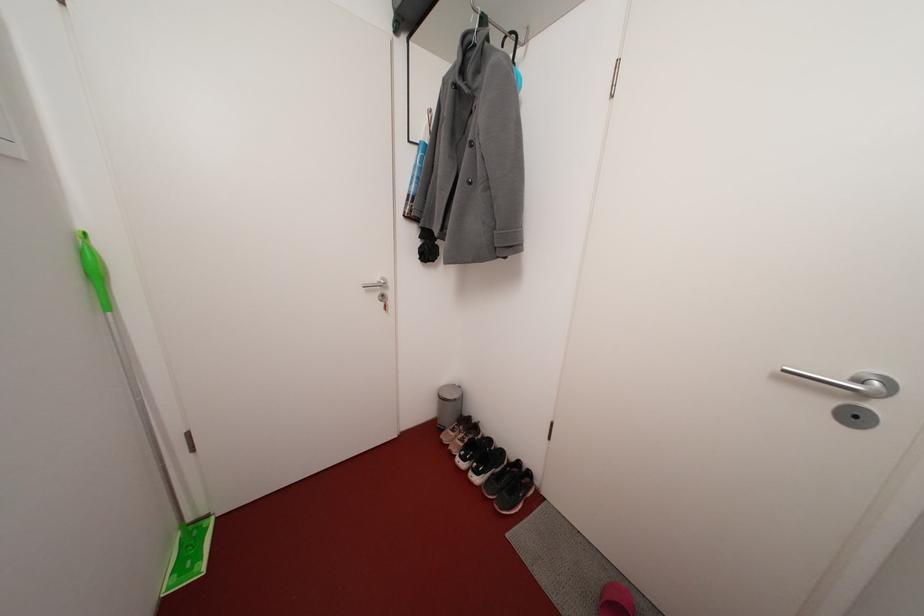
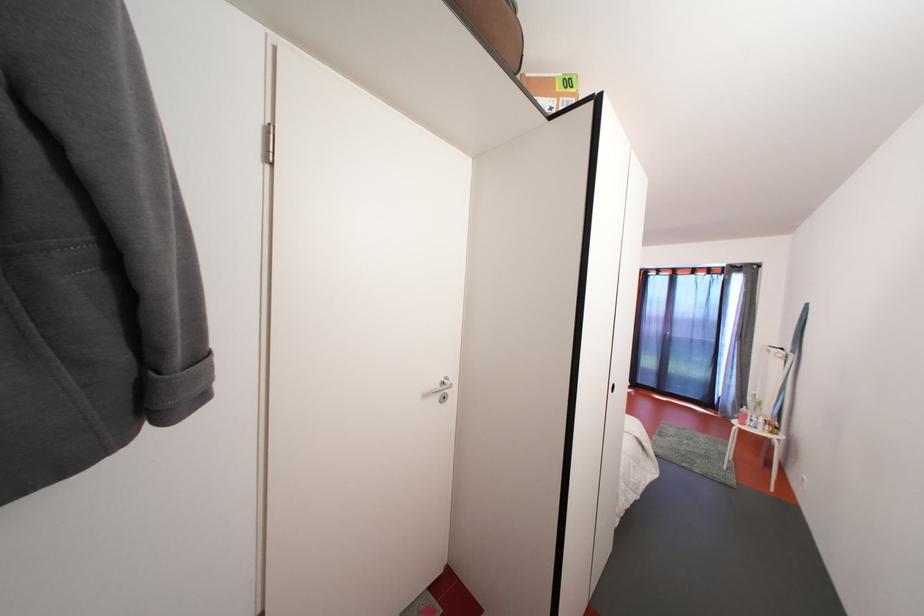
Question: The images are taken continuously from a first-person perspective. In which direction is your viewpoint rotating?

Choices:
 (A) Left
 (B) Right
 (C) Up
 (D) Down

Answer: (B)